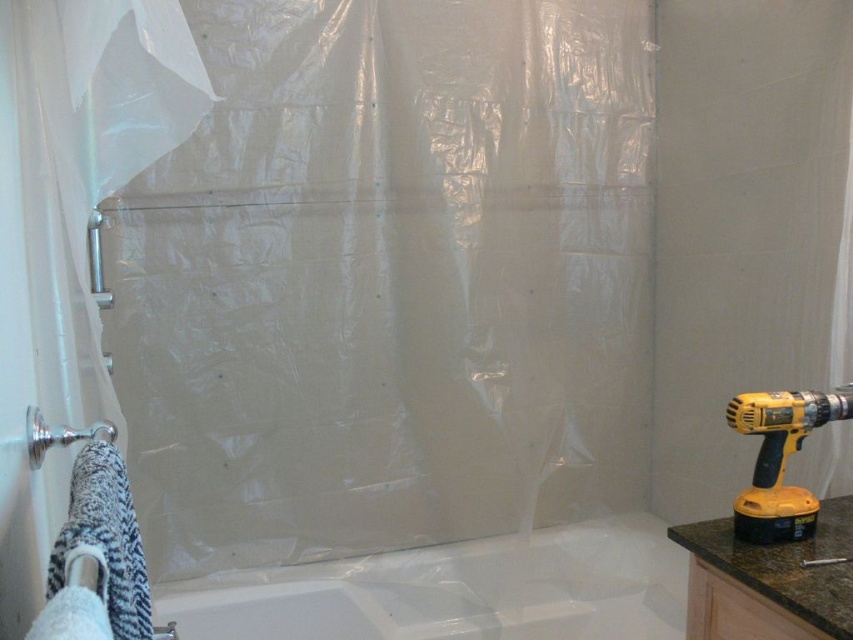
Does white glossy sink at lower center have a larger size compared to yellow plastic drill at right?

Indeed, white glossy sink at lower center has a larger size compared to yellow plastic drill at right.

Does white glossy sink at lower center have a greater width compared to yellow plastic drill at right?

Yes.

From the picture: Who is more forward, (300, 600) or (810, 566)?

Point (810, 566) is in front.

The image size is (853, 640). What are the coordinates of `white glossy sink at lower center` in the screenshot? It's located at (331, 611).

Based on the photo, how distant is transparent plastic shower curtain at upper center from white fabric towel bar at left?

transparent plastic shower curtain at upper center and white fabric towel bar at left are 5.92 feet apart from each other.

Is transparent plastic shower curtain at upper center to the left of white fabric towel bar at left from the viewer's perspective?

No, transparent plastic shower curtain at upper center is not to the left of white fabric towel bar at left.

Between point (430, 22) and point (67, 577), which one is positioned behind?

Point (430, 22)

This screenshot has height=640, width=853. Identify the location of transparent plastic shower curtain at upper center. (389, 280).

Can you confirm if yellow/black cordless drill at right is bigger than yellow plastic drill at right?

Yes, yellow/black cordless drill at right is bigger than yellow plastic drill at right.

Which is above, yellow/black cordless drill at right or yellow plastic drill at right?

yellow/black cordless drill at right

Between point (755, 536) and point (817, 561), which one is positioned behind?

The point (755, 536) is more distant.

I want to click on yellow/black cordless drill at right, so click(x=780, y=460).